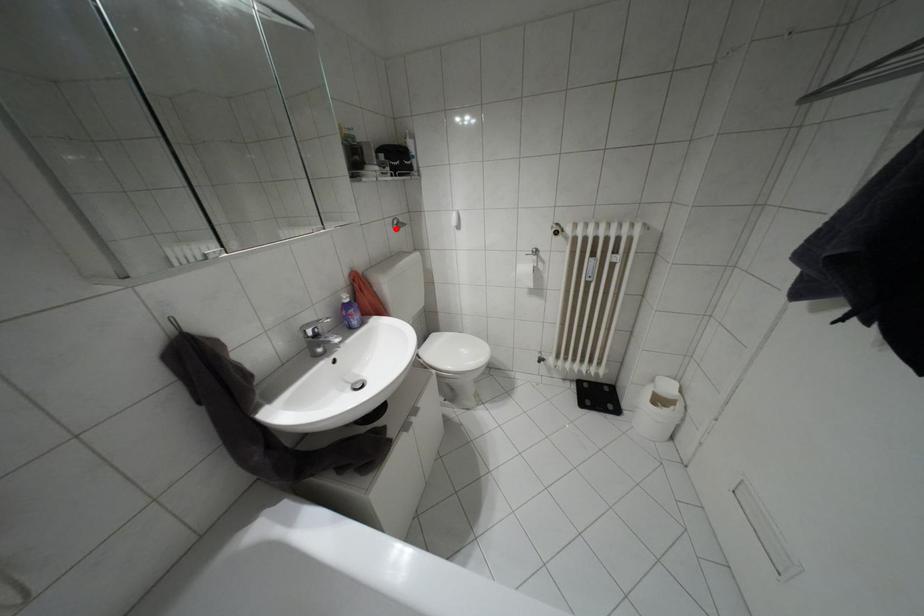
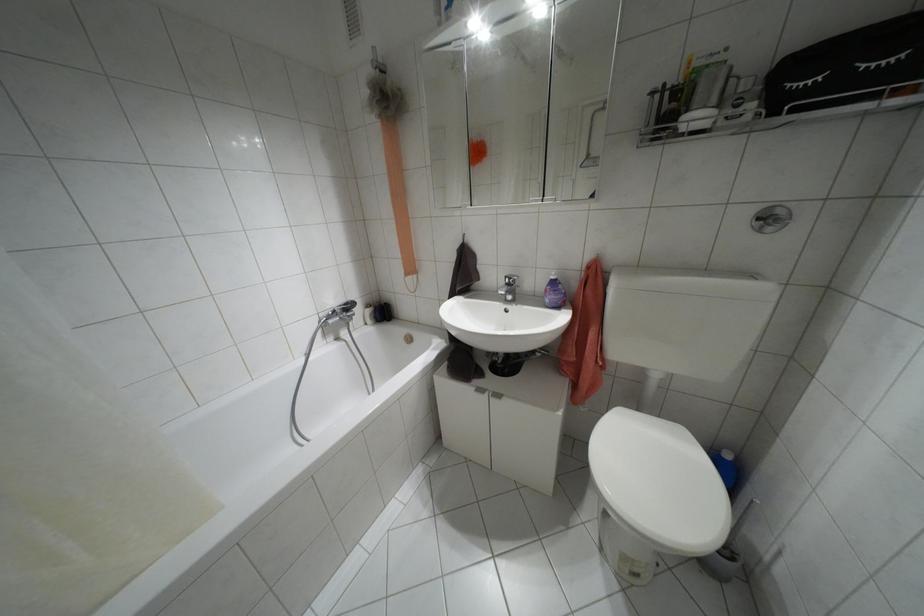
The point at the highlighted location is marked in the first image. Where is the corresponding point in the second image?

(769, 228)